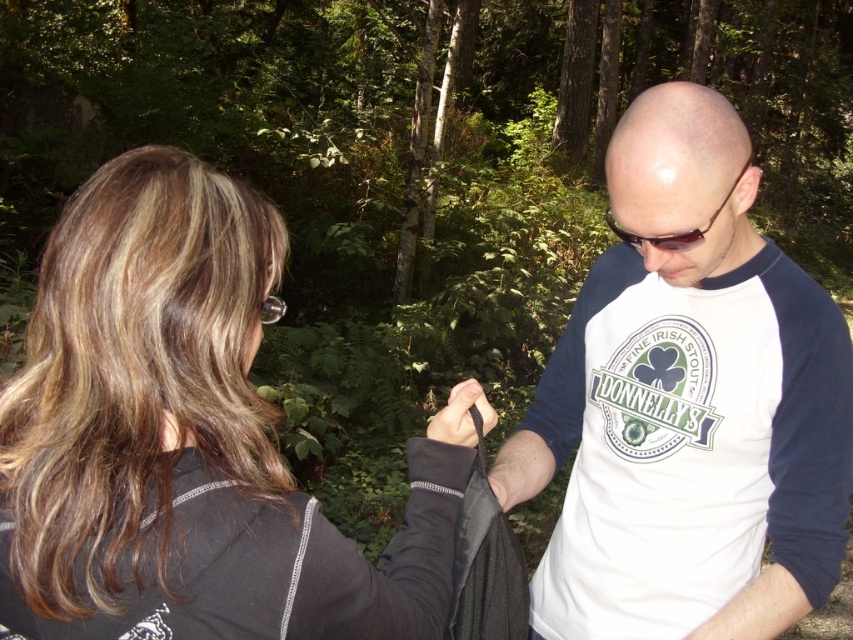
You are a photographer standing between the two people in the forest scene. You want to take a photo of both the black fabric jacket at left and the person on the right. How far apart are they from each other?

The black fabric jacket at left and the person on the right are 23.84 inches apart.

You are a photographer trying to capture the white fabric shirt at center and the black plastic goggles at upper center in the same frame. Which object should you focus on first if you want to ensure both are in focus? Please explain your reasoning based on their sizes.

The white fabric shirt at center is larger in size than the black plastic goggles at upper center. To ensure both are in focus, you should focus on the white fabric shirt at center first because larger objects generally require more precise focusing to maintain clarity across their entire surface area.

You are a hiker trying to locate your gear. You see the black fabric jacket at left and the black plastic goggles at upper center. Which item is closer to the left edge of your field of view?

The black fabric jacket at left is closer to the left edge of your field of view since it is positioned on the left side of the black plastic goggles at upper center.